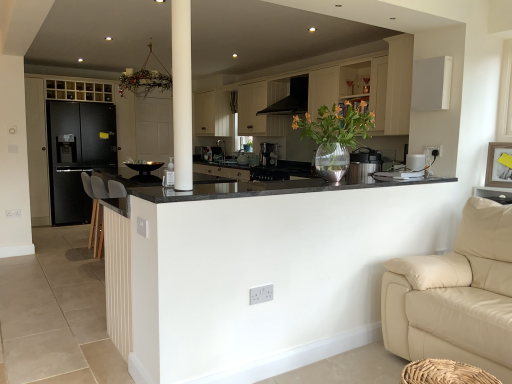
Question: Considering the relative positions of satin silver toaster at center, the 4th appliance in the right-to-left sequence, and clear glass vase at center in the image provided, is satin silver toaster at center, the 4th appliance in the right-to-left sequence, to the left or to the right of clear glass vase at center?

Choices:
 (A) right
 (B) left

Answer: (B)

Question: In terms of height, does satin silver toaster at center, the third appliance in the front-to-back sequence, look taller or shorter compared to clear glass vase at center?

Choices:
 (A) tall
 (B) short

Answer: (B)

Question: Considering the real-world distances, which object is closest to the black matte refrigerator at left, which is counted as the 2th cabinetry, starting from the right?

Choices:
 (A) black granite countertop at center
 (B) satin black coffee maker at center, arranged as the third appliance when viewed from the right
 (C) black plastic thermos at center, the third appliance viewed from the left
 (D) white plastic toaster at upper right, which is counted as the first appliance, starting from the front
 (E) clear glass vase at center

Answer: (B)

Question: Estimate the real-world distances between objects in this image. Which object is closer to the black granite countertop at center?

Choices:
 (A) black matte refrigerator at left, which is counted as the 2th cabinetry, starting from the right
 (B) black plastic thermos at center, which ranks as the second appliance in front-to-back order
 (C) satin silver toaster at center, which is the 1th appliance in left-to-right order
 (D) satin black coffee machine at center
 (E) satin black coffee maker at center, which is counted as the second appliance, starting from the left

Answer: (B)